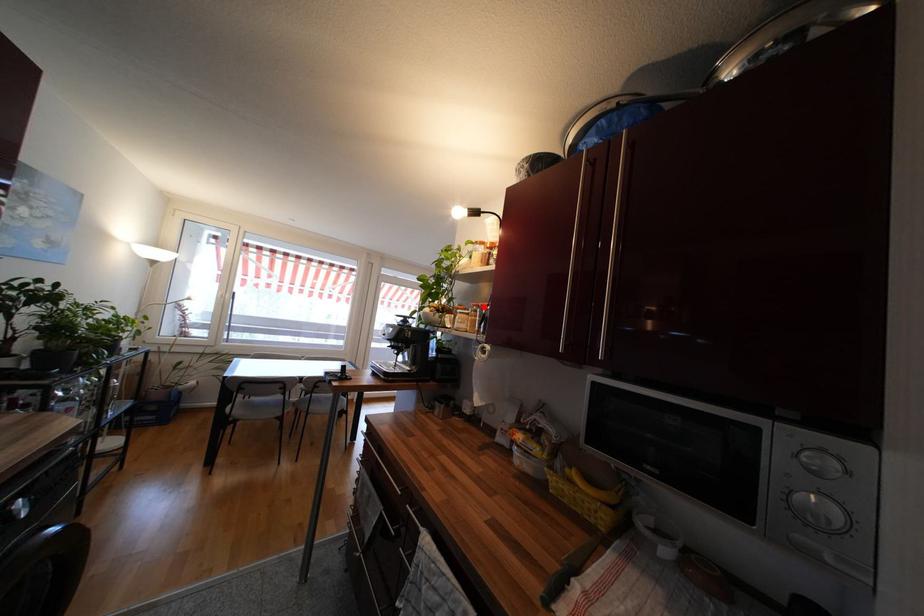
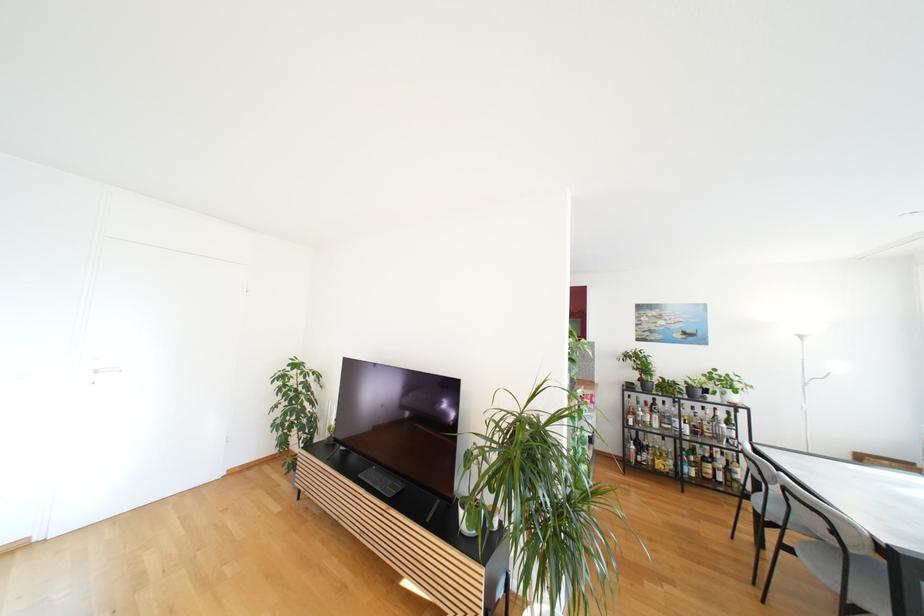
Question: I am providing you with two images of the same scene from different viewpoints. A red point is marked on the first image. Is the red point's position out of view in image 2?

Choices:
 (A) Yes
 (B) No

Answer: (A)